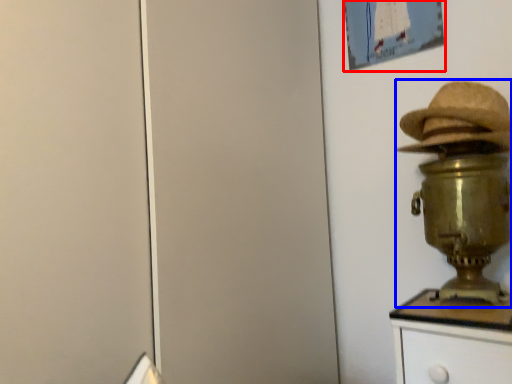
Question: Which object is closer to the camera taking this photo, picture frame (highlighted by a red box) or table lamp (highlighted by a blue box)?

Choices:
 (A) picture frame
 (B) table lamp

Answer: (B)